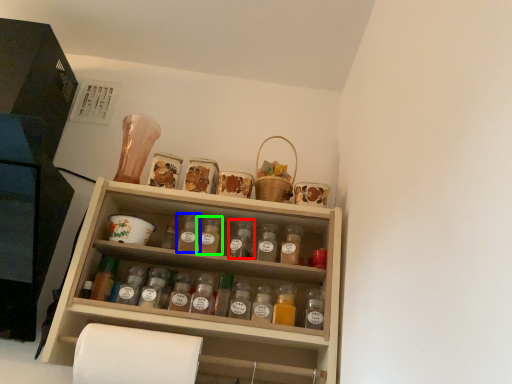
Question: Which object is the farthest from bottle (highlighted by a red box)? Choose among these: bottle (highlighted by a blue box) or bottle (highlighted by a green box).

Choices:
 (A) bottle
 (B) bottle

Answer: (A)